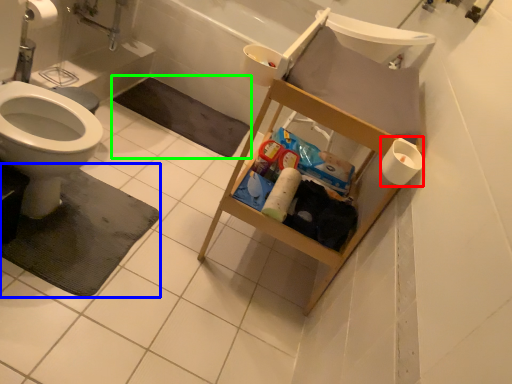
Question: Which is farther away from toilet paper (highlighted by a red box)? bath mat (highlighted by a blue box) or bath mat (highlighted by a green box)?

Choices:
 (A) bath mat
 (B) bath mat

Answer: (B)